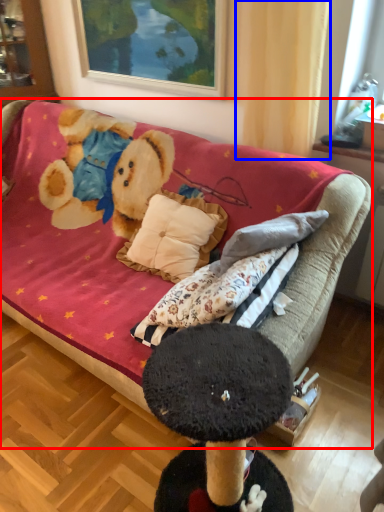
Question: Which point is further to the camera, studio couch (highlighted by a red box) or curtain (highlighted by a blue box)?

Choices:
 (A) studio couch
 (B) curtain

Answer: (B)